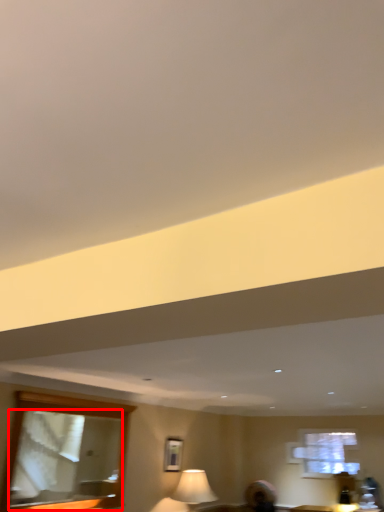
Question: In this image, where is mirror (annotated by the red box) located relative to picture frame?

Choices:
 (A) right
 (B) left

Answer: (B)